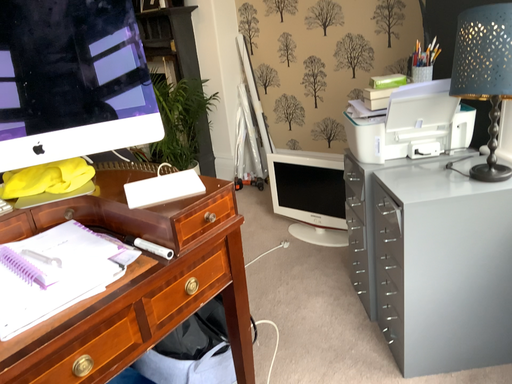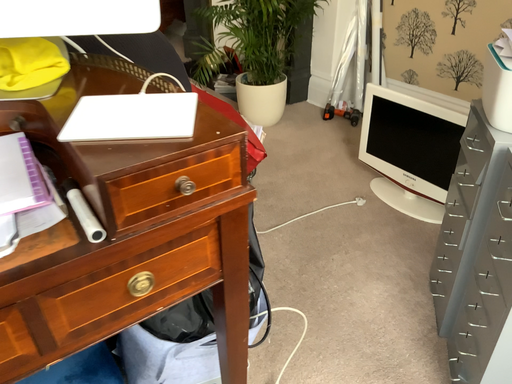
Question: Which way did the camera rotate in the video?

Choices:
 (A) rotated upward
 (B) rotated downward

Answer: (B)